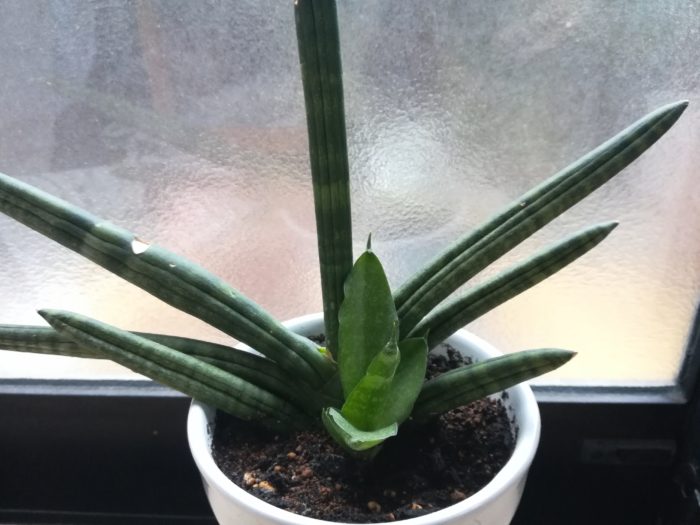
Find the location of a particular element. Image resolution: width=700 pixels, height=525 pixels. handle to lift window is located at coordinates (626, 460).